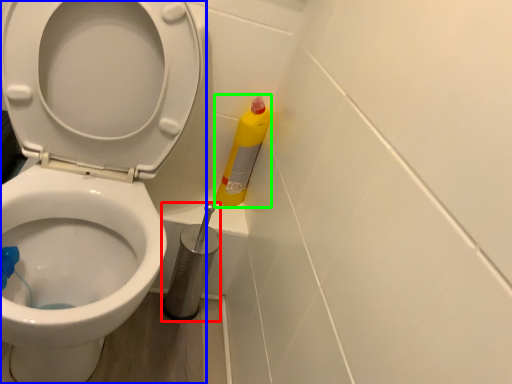
Question: Which object is positioned closest to brush (highlighted by a red box)? Select from toilet (highlighted by a blue box) and cleaning product (highlighted by a green box).

Choices:
 (A) toilet
 (B) cleaning product

Answer: (B)